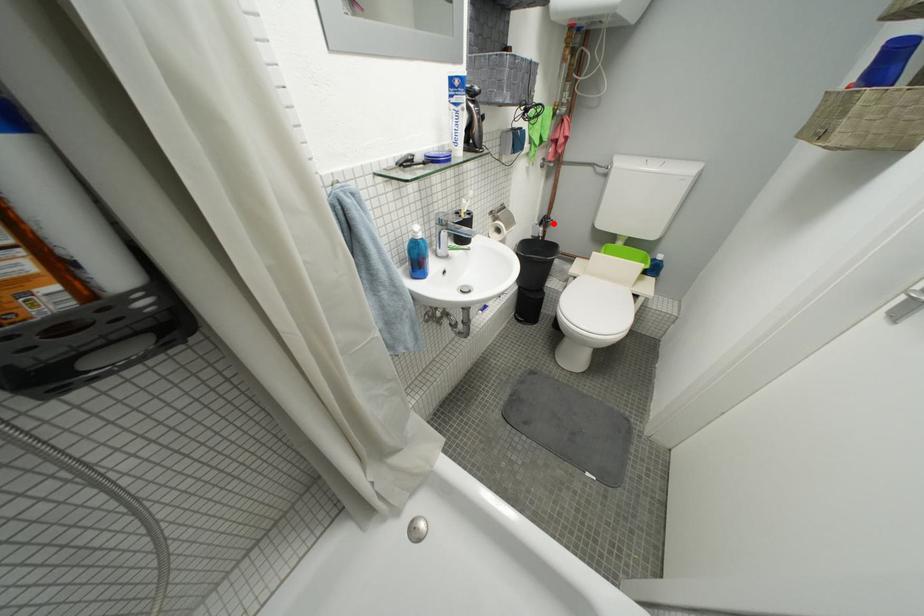
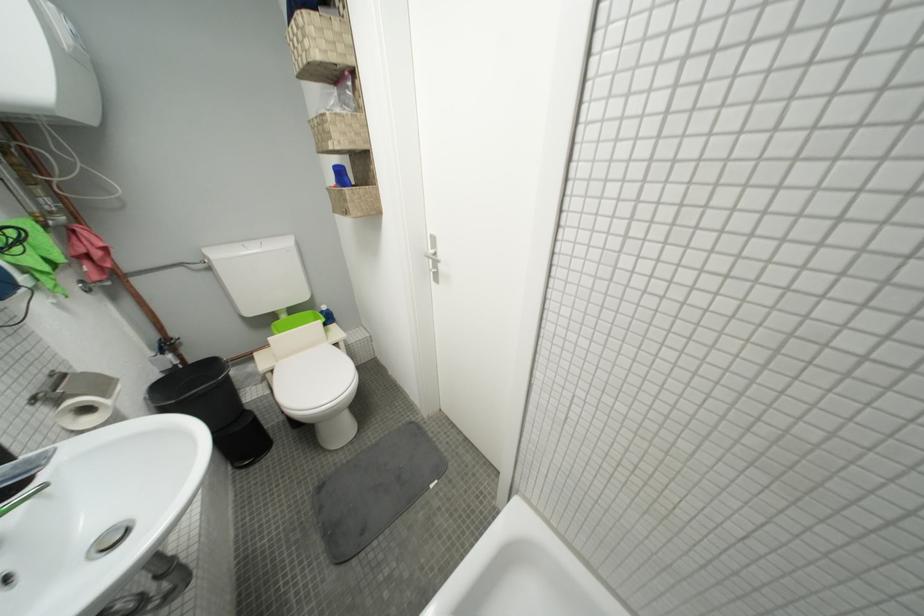
Find the pixel in the second image that matches the highlighted location in the first image.

(175, 347)